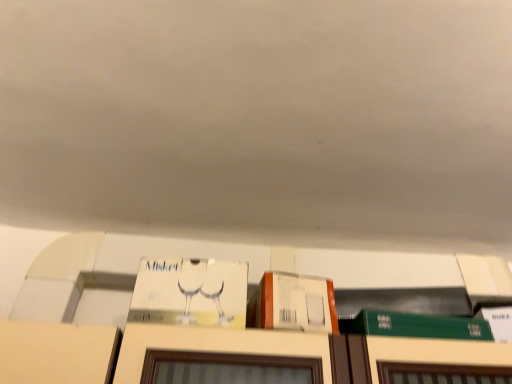
Question: Relative to white cardboard box at center, the second book viewed from the right, is orange matte cardboard box at upper center in front or behind?

Choices:
 (A) behind
 (B) front

Answer: (B)

Question: Would you say orange matte cardboard box at upper center is inside or outside white cardboard box at center, arranged as the 1th book when viewed from the left?

Choices:
 (A) outside
 (B) inside

Answer: (A)

Question: Considering the real-world distances, which object is closest to the orange matte cardboard box at upper center?

Choices:
 (A) green matte book at lower right, the second book from the left
 (B) white cardboard box at center, the second book viewed from the right

Answer: (B)

Question: Which of these objects is positioned closest to the green matte book at lower right, the second book from the left?

Choices:
 (A) white cardboard box at center, arranged as the 1th book when viewed from the left
 (B) orange matte cardboard box at upper center

Answer: (B)